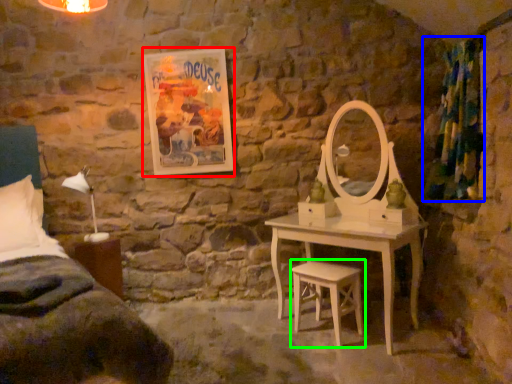
Question: Estimate the real-world distances between objects in this image. Which object is farther from picture frame (highlighted by a red box), curtain (highlighted by a blue box) or stool (highlighted by a green box)?

Choices:
 (A) curtain
 (B) stool

Answer: (A)